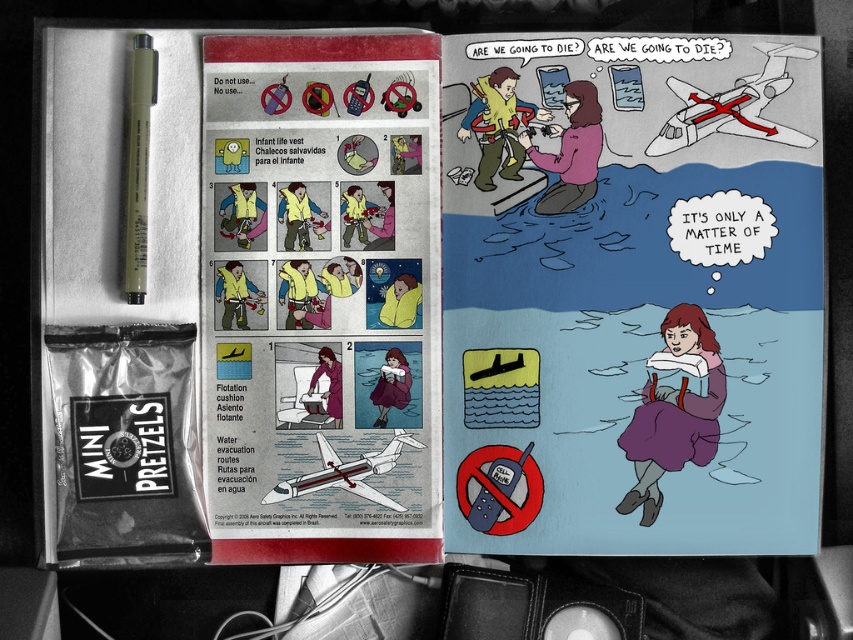
You are an airline attendant checking the safety instructions. You see the purple fabric dress at lower center and the olive matte pen at upper left. Which object is located lower in the image?

The purple fabric dress at lower center is positioned under the olive matte pen at upper left, so it is located lower in the image.

You are sitting in an airplane seat and notice two items in front of you. One is the yellow paper at upper center and the other is the purple fabric dress at lower center. Which item is located higher from the ground?

The yellow paper at upper center is above the purple fabric dress at lower center, so it is higher from the ground.